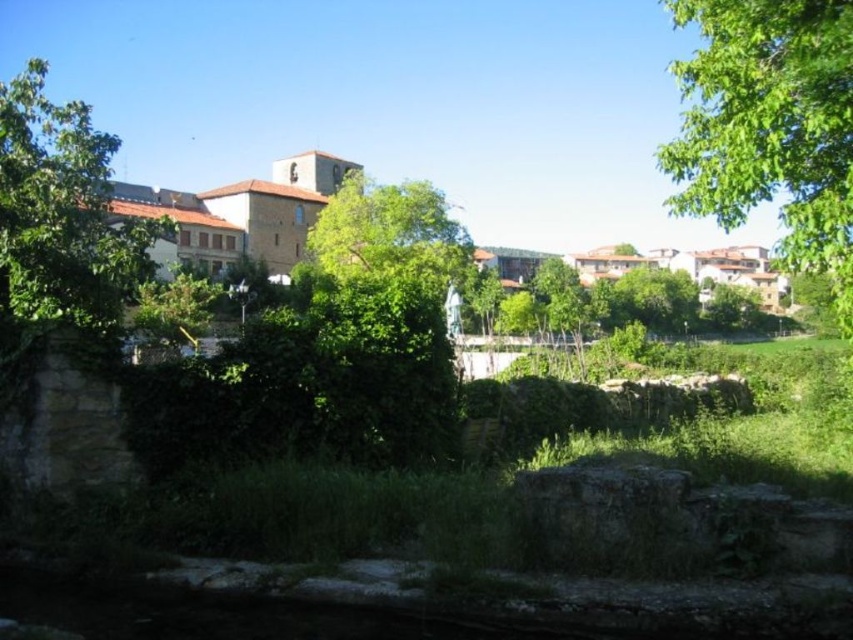
The height and width of the screenshot is (640, 853). What do you see at coordinates (770, 125) in the screenshot?
I see `green leafy tree at upper right` at bounding box center [770, 125].

Can you confirm if green leafy tree at upper right is smaller than green leafy tree at upper left?

Incorrect, green leafy tree at upper right is not smaller in size than green leafy tree at upper left.

Who is more forward, (811, 160) or (119, 248)?

Positioned in front is point (811, 160).

Locate an element on the screen. The image size is (853, 640). green leafy tree at upper right is located at coordinates (770, 125).